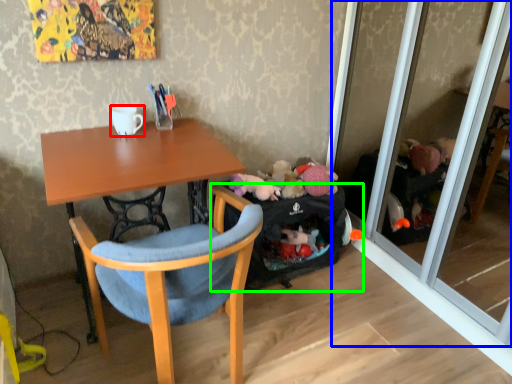
Question: Which is farther away from coffee cup (highlighted by a red box)? screen door (highlighted by a blue box) or luggage and bags (highlighted by a green box)?

Choices:
 (A) screen door
 (B) luggage and bags

Answer: (A)